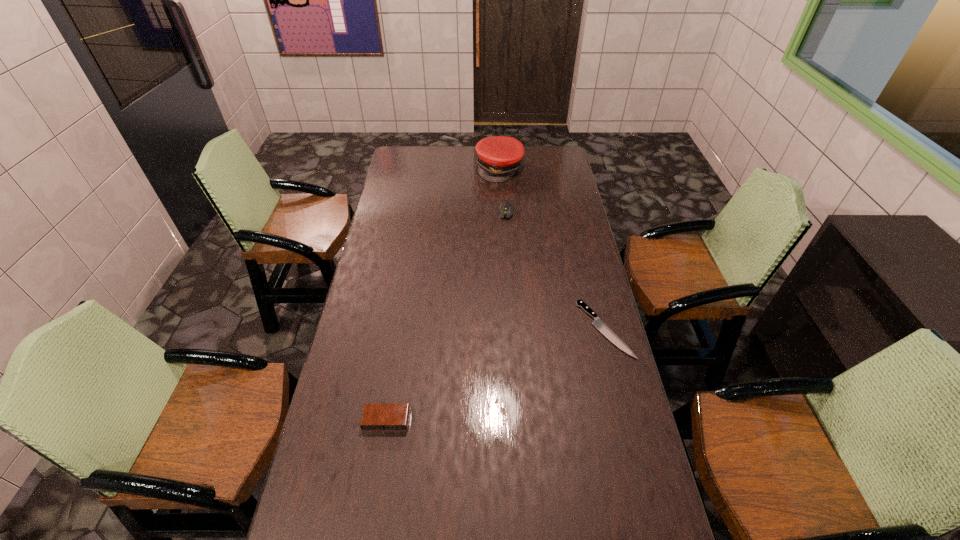
This screenshot has height=540, width=960. I want to click on empty space between the second farthest object and the steak knife, so click(556, 271).

What are the coordinates of `vacant area between the steak knife and the second farthest object` in the screenshot? It's located at tap(556, 271).

This screenshot has width=960, height=540. Identify the location of free area in between the cap and the nearest object. (444, 294).

Locate an element on the screen. free space between the computer mouse and the tallest object is located at coordinates (503, 190).

This screenshot has height=540, width=960. In order to click on free area in between the cap and the shortest object in this screenshot , I will do `click(552, 249)`.

The image size is (960, 540). What are the coordinates of `unoccupied area between the cap and the second nearest object` in the screenshot? It's located at (552, 249).

Locate an element on the screen. This screenshot has height=540, width=960. object that is the closest to the third tallest object is located at coordinates (598, 323).

Image resolution: width=960 pixels, height=540 pixels. Identify the location of the closest object to the tallest object. (506, 209).

The width and height of the screenshot is (960, 540). In order to click on vacant space that satisfies the following two spatial constraints: 1. on the front side of the steak knife; 2. on the right side of the third nearest object in this screenshot , I will do click(515, 329).